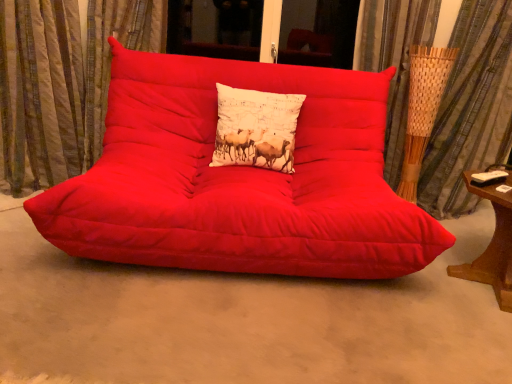
Question: Does textured beige curtain at left, marked as the second curtain in a right-to-left arrangement, have a lesser width compared to white cotton cushion at center?

Choices:
 (A) yes
 (B) no

Answer: (B)

Question: Is textured beige curtain at left, which ranks as the 1th curtain in left-to-right order, oriented towards white cotton cushion at center?

Choices:
 (A) no
 (B) yes

Answer: (A)

Question: Considering the relative sizes of textured beige curtain at left, which ranks as the 1th curtain in left-to-right order, and white cotton cushion at center in the image provided, is textured beige curtain at left, which ranks as the 1th curtain in left-to-right order, shorter than white cotton cushion at center?

Choices:
 (A) no
 (B) yes

Answer: (A)

Question: Considering the relative sizes of textured beige curtain at left, which ranks as the 1th curtain in left-to-right order, and white cotton cushion at center in the image provided, is textured beige curtain at left, which ranks as the 1th curtain in left-to-right order, smaller than white cotton cushion at center?

Choices:
 (A) no
 (B) yes

Answer: (A)

Question: Is textured beige curtain at left, which ranks as the 1th curtain in left-to-right order, further to the viewer compared to white cotton cushion at center?

Choices:
 (A) no
 (B) yes

Answer: (A)

Question: Is textured beige curtain at left, which ranks as the 1th curtain in left-to-right order, taller than white cotton cushion at center?

Choices:
 (A) yes
 (B) no

Answer: (A)

Question: Is woven bamboo curtain at right, the second curtain when ordered from left to right, far from textured beige curtain at left, which ranks as the 1th curtain in left-to-right order?

Choices:
 (A) no
 (B) yes

Answer: (B)

Question: Is woven bamboo curtain at right, the 1th curtain viewed from the right, looking in the opposite direction of textured beige curtain at left, marked as the second curtain in a right-to-left arrangement?

Choices:
 (A) yes
 (B) no

Answer: (B)

Question: Is woven bamboo curtain at right, the second curtain when ordered from left to right, thinner than textured beige curtain at left, which ranks as the 1th curtain in left-to-right order?

Choices:
 (A) yes
 (B) no

Answer: (B)

Question: Is woven bamboo curtain at right, the 1th curtain viewed from the right, closer to the viewer compared to textured beige curtain at left, marked as the second curtain in a right-to-left arrangement?

Choices:
 (A) no
 (B) yes

Answer: (A)

Question: From a real-world perspective, does woven bamboo curtain at right, the second curtain when ordered from left to right, sit lower than textured beige curtain at left, marked as the second curtain in a right-to-left arrangement?

Choices:
 (A) yes
 (B) no

Answer: (B)

Question: Does woven bamboo curtain at right, the 1th curtain viewed from the right, have a smaller size compared to textured beige curtain at left, marked as the second curtain in a right-to-left arrangement?

Choices:
 (A) no
 (B) yes

Answer: (A)

Question: From the image's perspective, is white cotton cushion at center below matte red studio couch at center?

Choices:
 (A) yes
 (B) no

Answer: (B)